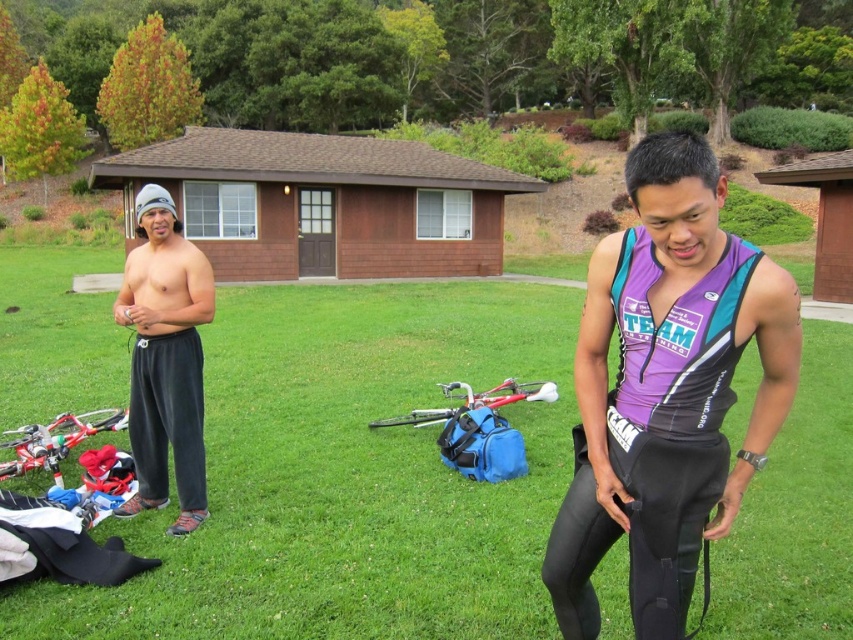
Can you confirm if purple fabric triathlon suit at center is wider than gray sweatpants at left?

Indeed, purple fabric triathlon suit at center has a greater width compared to gray sweatpants at left.

Is purple fabric triathlon suit at center above gray sweatpants at left?

Incorrect, purple fabric triathlon suit at center is not positioned above gray sweatpants at left.

Find the location of `purple fabric triathlon suit at center`. purple fabric triathlon suit at center is located at coordinates (666, 388).

In the scene shown: Does green grass at center have a larger size compared to gray sweatpants at left?

Correct, green grass at center is larger in size than gray sweatpants at left.

Is point (412, 436) positioned in front of point (128, 310)?

No.

At what (x,y) coordinates should I click in order to perform the action: click on green grass at center. Please return your answer as a coordinate pair (x, y). The width and height of the screenshot is (853, 640). Looking at the image, I should click on (347, 476).

Is green grass at center below purple fabric triathlon suit at center?

Incorrect, green grass at center is not positioned below purple fabric triathlon suit at center.

Measure the distance from green grass at center to purple fabric triathlon suit at center.

green grass at center and purple fabric triathlon suit at center are 17.86 feet apart from each other.

I want to click on green grass at center, so click(347, 476).